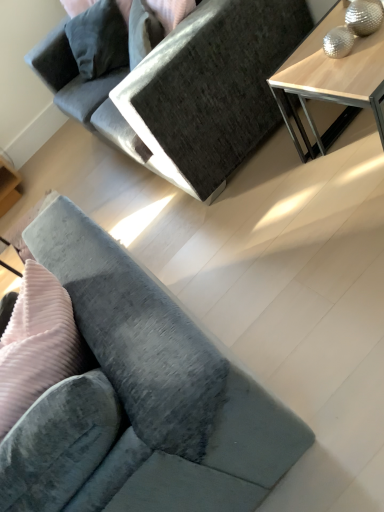
What do you see at coordinates (187, 88) in the screenshot? This screenshot has width=384, height=512. I see `velvet gray couch at center, the 1th studio couch positioned from the top` at bounding box center [187, 88].

In order to click on light wood table at upper right in this screenshot , I will do 331,77.

This screenshot has width=384, height=512. What are the coordinates of `velvet gray couch at center, the 2th studio couch from the bottom` in the screenshot? It's located at (187, 88).

Is velvet grey couch at lower left, which is the first studio couch in bottom-to-top order, positioned with its back to light wood table at upper right?

No, velvet grey couch at lower left, which is the first studio couch in bottom-to-top order,'s orientation is not away from light wood table at upper right.

From a real-world perspective, is velvet grey couch at lower left, marked as the 2th studio couch in a top-to-bottom arrangement, physically located above or below light wood table at upper right?

Clearly, from a real-world perspective, velvet grey couch at lower left, marked as the 2th studio couch in a top-to-bottom arrangement, is above light wood table at upper right.

Is velvet grey couch at lower left, marked as the 2th studio couch in a top-to-bottom arrangement, closer to the viewer compared to light wood table at upper right?

Yes, velvet grey couch at lower left, marked as the 2th studio couch in a top-to-bottom arrangement, is closer to the viewer.

Does velvet grey couch at lower left, which is the first studio couch in bottom-to-top order, have a larger size compared to light wood table at upper right?

Yes, velvet grey couch at lower left, which is the first studio couch in bottom-to-top order, is bigger than light wood table at upper right.

This screenshot has height=512, width=384. I want to click on table below the velvet gray couch at center, the 1th studio couch positioned from the top (from a real-world perspective), so click(331, 77).

Is velvet gray couch at center, the 2th studio couch from the bottom, not near light wood table at upper right?

That's not correct — velvet gray couch at center, the 2th studio couch from the bottom, is a little close to light wood table at upper right.

Can you confirm if velvet gray couch at center, the 1th studio couch positioned from the top, is shorter than light wood table at upper right?

In fact, velvet gray couch at center, the 1th studio couch positioned from the top, may be taller than light wood table at upper right.

How far apart are velvet gray couch at center, the 2th studio couch from the bottom, and light wood table at upper right?

The distance of velvet gray couch at center, the 2th studio couch from the bottom, from light wood table at upper right is 22.40 inches.

Would you say light wood table at upper right contains velvet gray couch at center, the 2th studio couch from the bottom?

No, light wood table at upper right does not contain velvet gray couch at center, the 2th studio couch from the bottom.

Looking at their sizes, would you say light wood table at upper right is wider or thinner than velvet gray couch at center, the 1th studio couch positioned from the top?

In the image, light wood table at upper right appears to be more narrow than velvet gray couch at center, the 1th studio couch positioned from the top.

Between light wood table at upper right and velvet gray couch at center, the 2th studio couch from the bottom, which one appears on the right side from the viewer's perspective?

light wood table at upper right is more to the right.

Between light wood table at upper right and velvet gray couch at center, the 1th studio couch positioned from the top, which one is positioned behind?

velvet gray couch at center, the 1th studio couch positioned from the top, is behind.

Which is behind, velvet grey couch at lower left, marked as the 2th studio couch in a top-to-bottom arrangement, or velvet gray couch at center, the 2th studio couch from the bottom?

velvet gray couch at center, the 2th studio couch from the bottom, is further away from the camera.

Looking at the image, does velvet grey couch at lower left, marked as the 2th studio couch in a top-to-bottom arrangement, seem bigger or smaller compared to velvet gray couch at center, the 1th studio couch positioned from the top?

Considering their sizes, velvet grey couch at lower left, marked as the 2th studio couch in a top-to-bottom arrangement, takes up less space than velvet gray couch at center, the 1th studio couch positioned from the top.

Which is correct: velvet grey couch at lower left, marked as the 2th studio couch in a top-to-bottom arrangement, is inside velvet gray couch at center, the 1th studio couch positioned from the top, or outside of it?

velvet grey couch at lower left, marked as the 2th studio couch in a top-to-bottom arrangement, is outside velvet gray couch at center, the 1th studio couch positioned from the top.

Does velvet gray couch at center, the 1th studio couch positioned from the top, have a greater width compared to velvet grey couch at lower left, marked as the 2th studio couch in a top-to-bottom arrangement?

No.

Is velvet gray couch at center, the 2th studio couch from the bottom, facing away from velvet grey couch at lower left, marked as the 2th studio couch in a top-to-bottom arrangement?

No, velvet gray couch at center, the 2th studio couch from the bottom, is not facing away from velvet grey couch at lower left, marked as the 2th studio couch in a top-to-bottom arrangement.

Between velvet gray couch at center, the 1th studio couch positioned from the top, and velvet grey couch at lower left, which is the first studio couch in bottom-to-top order, which one has more height?

velvet gray couch at center, the 1th studio couch positioned from the top.

This screenshot has width=384, height=512. In order to click on studio couch above the velvet grey couch at lower left, marked as the 2th studio couch in a top-to-bottom arrangement (from a real-world perspective) in this screenshot , I will do `click(187, 88)`.

Could you tell me if light wood table at upper right is facing velvet grey couch at lower left, which is the first studio couch in bottom-to-top order?

Yes.

Considering the relative positions of light wood table at upper right and velvet grey couch at lower left, marked as the 2th studio couch in a top-to-bottom arrangement, in the image provided, is light wood table at upper right in front of velvet grey couch at lower left, marked as the 2th studio couch in a top-to-bottom arrangement,?

No, light wood table at upper right is behind velvet grey couch at lower left, marked as the 2th studio couch in a top-to-bottom arrangement.

At what (x,y) coordinates should I click in order to perform the action: click on table behind the velvet grey couch at lower left, which is the first studio couch in bottom-to-top order. Please return your answer as a coordinate pair (x, y). Looking at the image, I should click on (331, 77).

What's the angular difference between light wood table at upper right and velvet grey couch at lower left, which is the first studio couch in bottom-to-top order,'s facing directions?

light wood table at upper right and velvet grey couch at lower left, which is the first studio couch in bottom-to-top order, are facing 92.9 degrees away from each other.

Where is `table behind the velvet grey couch at lower left, which is the first studio couch in bottom-to-top order`? Image resolution: width=384 pixels, height=512 pixels. table behind the velvet grey couch at lower left, which is the first studio couch in bottom-to-top order is located at coordinates (331, 77).

This screenshot has height=512, width=384. Identify the location of table on the right of velvet gray couch at center, the 2th studio couch from the bottom. (331, 77).

When comparing their distances from velvet grey couch at lower left, which is the first studio couch in bottom-to-top order, does light wood table at upper right or velvet gray couch at center, the 2th studio couch from the bottom, seem further?

velvet gray couch at center, the 2th studio couch from the bottom.

When comparing their distances from velvet gray couch at center, the 1th studio couch positioned from the top, does velvet grey couch at lower left, marked as the 2th studio couch in a top-to-bottom arrangement, or light wood table at upper right seem further?

Among the two, velvet grey couch at lower left, marked as the 2th studio couch in a top-to-bottom arrangement, is located further to velvet gray couch at center, the 1th studio couch positioned from the top.

Which object lies nearer to the anchor point light wood table at upper right, velvet grey couch at lower left, which is the first studio couch in bottom-to-top order, or velvet gray couch at center, the 2th studio couch from the bottom?

velvet gray couch at center, the 2th studio couch from the bottom.

When comparing their distances from light wood table at upper right, does velvet gray couch at center, the 1th studio couch positioned from the top, or velvet grey couch at lower left, which is the first studio couch in bottom-to-top order, seem closer?

velvet gray couch at center, the 1th studio couch positioned from the top, lies closer to light wood table at upper right than the other object.

Considering their positions, is velvet gray couch at center, the 1th studio couch positioned from the top, positioned further to velvet grey couch at lower left, which is the first studio couch in bottom-to-top order, than light wood table at upper right?

Among the two, velvet gray couch at center, the 1th studio couch positioned from the top, is located further to velvet grey couch at lower left, which is the first studio couch in bottom-to-top order.

In the scene shown: Looking at the image, which one is located closer to velvet gray couch at center, the 1th studio couch positioned from the top, light wood table at upper right or velvet grey couch at lower left, which is the first studio couch in bottom-to-top order?

light wood table at upper right lies closer to velvet gray couch at center, the 1th studio couch positioned from the top, than the other object.

Find the location of a particular element. table between velvet gray couch at center, the 2th studio couch from the bottom, and velvet grey couch at lower left, marked as the 2th studio couch in a top-to-bottom arrangement, in the up-down direction is located at coordinates (331, 77).